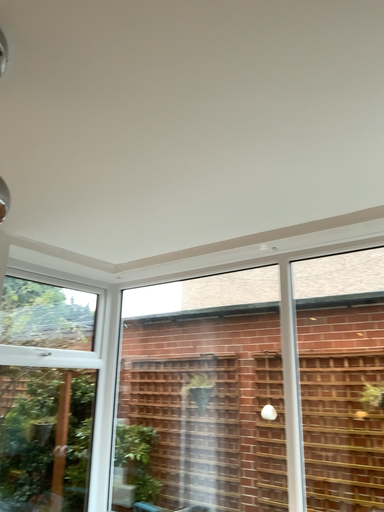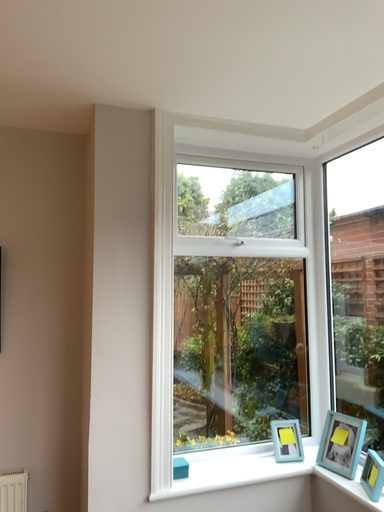
Question: How did the camera likely rotate when shooting the video?

Choices:
 (A) rotated upward
 (B) rotated downward

Answer: (B)